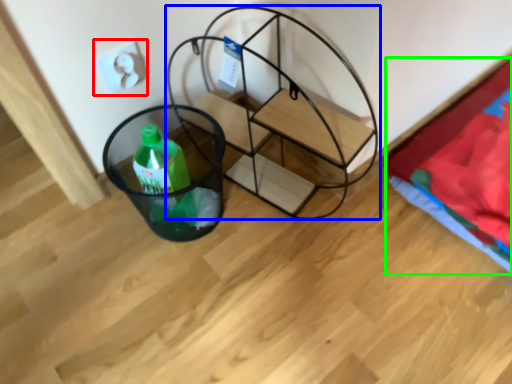
Question: Which object is positioned closest to electric outlet (highlighted by a red box)? Select from furniture (highlighted by a blue box) and blanket (highlighted by a green box).

Choices:
 (A) furniture
 (B) blanket

Answer: (A)